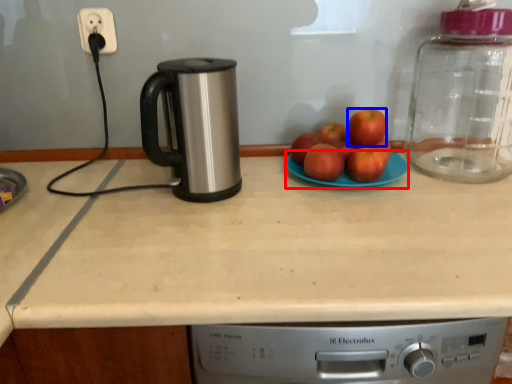
Question: Which object is closer to the camera taking this photo, paper plate (highlighted by a red box) or apple (highlighted by a blue box)?

Choices:
 (A) paper plate
 (B) apple

Answer: (A)